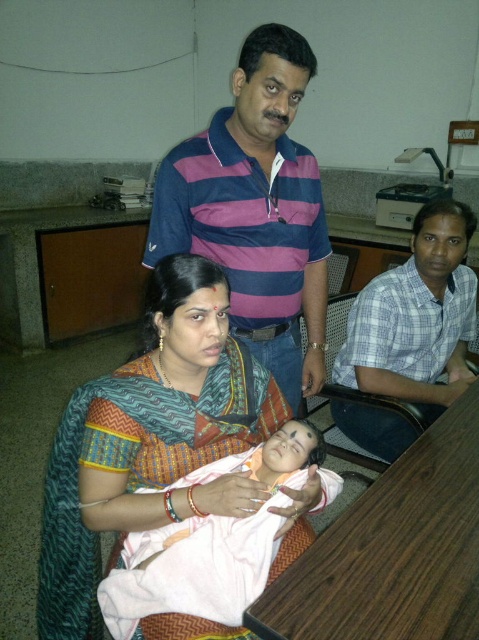
You are a visitor in this office and need to move from the point at the bottom left corner to the point at the bottom right corner. There are two points marked in the scene. The first point is at coordinates point (x=286, y=113) and the second is at point (x=278, y=518). Which point is closer to your starting position at the bottom left corner?

Point (x=286, y=113) is closer to the bottom left corner because it is located behind point (x=278, y=518), meaning it is nearer to the starting position.

You are an interior designer planning to place a new painting in the office. The painting is 0.3 meters wide and needs to be placed at point coordinates between 0.3 and 0.6 on the x and y axes. Is the purple striped polo shirt at upper center at point 0.328, 0.534 in the way of this placement?

The purple striped polo shirt at upper center is located at point coordinates [255,209], which falls within the specified range of 0.3 to 0.6 on both the x and y axes. Therefore, the painting placement would be obstructed by the purple striped polo shirt at upper center.

You are standing in the office and want to reach the point marked at coordinates (111, 515). The office has a 1.2 meter wide door to your left. Can you walk through the door to get to that point?

The distance between you and the point is 1.07 meters. Since the door is 1.2 meters wide, you can easily walk through the door to reach the point.